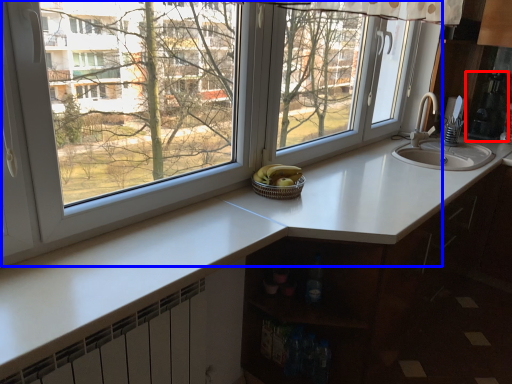
Question: Which point is further to the camera, appliance (highlighted by a red box) or window (highlighted by a blue box)?

Choices:
 (A) appliance
 (B) window

Answer: (A)